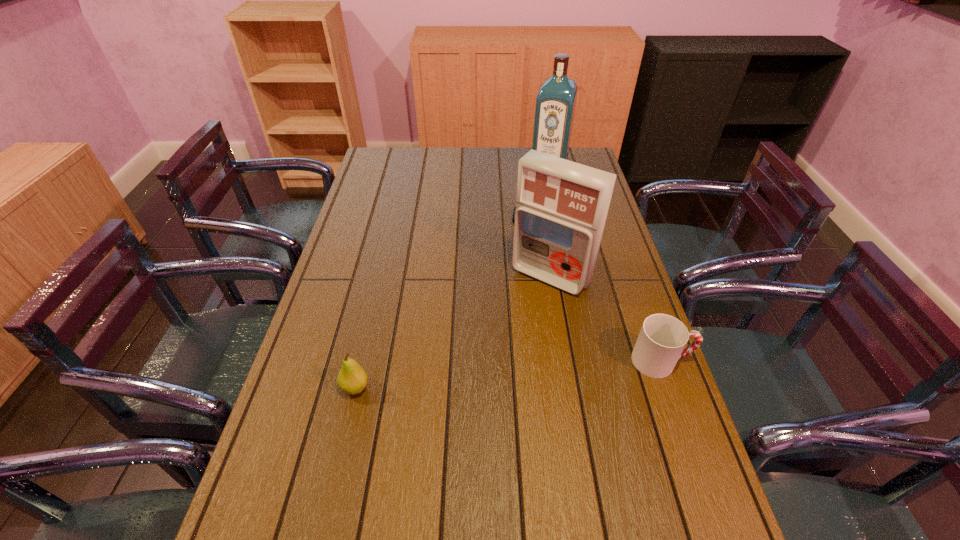
Where is `vacant space on the desktop that is between the pear and the rightmost object and is positioned on the display of the fourth nearest object`? The width and height of the screenshot is (960, 540). vacant space on the desktop that is between the pear and the rightmost object and is positioned on the display of the fourth nearest object is located at coordinates (516, 373).

Where is `vacant space on the desktop that is between the leftmost object and the cup and is positioned on the flat label side of the liquor`? The image size is (960, 540). vacant space on the desktop that is between the leftmost object and the cup and is positioned on the flat label side of the liquor is located at coordinates (475, 376).

Locate an element on the screen. This screenshot has height=540, width=960. vacant spot on the desktop that is between the pear and the rightmost object and is positioned on the front-facing side of the fourth shortest object is located at coordinates (472, 377).